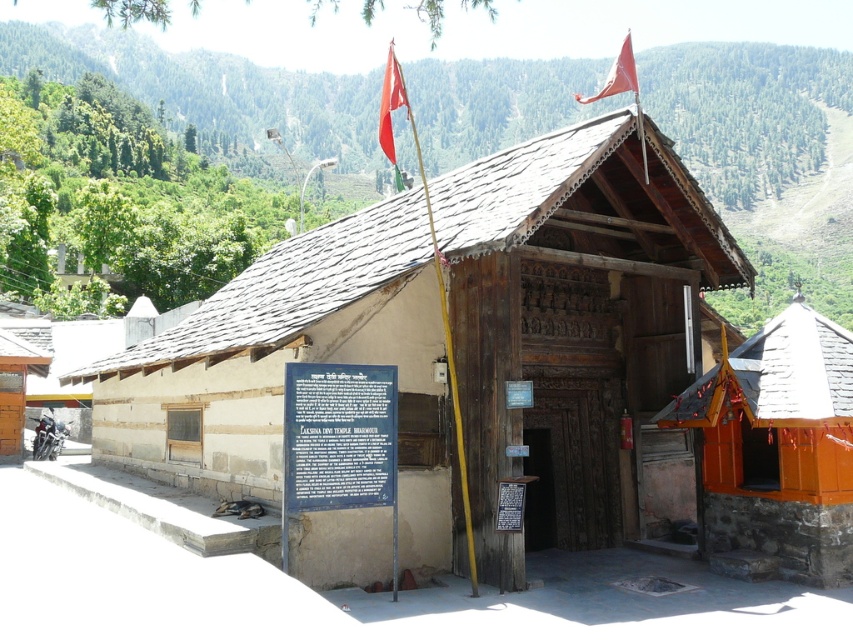
You are a tourist standing in front of the wooden door at center and want to take a photo of the wooden temple at center. Which direction should you face to capture the temple in your photo?

The wooden temple at center is positioned on the left side of the wooden door at center, so you should face to the left to capture the temple in your photo.

You are a tourist standing at the entrance of the temple, and you want to take a photo of both the green grassy mountain at upper center and the black metal sign at center in the same frame. Given that your camera has a maximum zoom range of 50 meters, will you be able to capture both objects in a single photo?

The green grassy mountain at upper center and black metal sign at center are 42.96 meters apart. Since your camera can zoom up to 50 meters, you can capture both objects in a single photo as the distance between them is within the camera range.